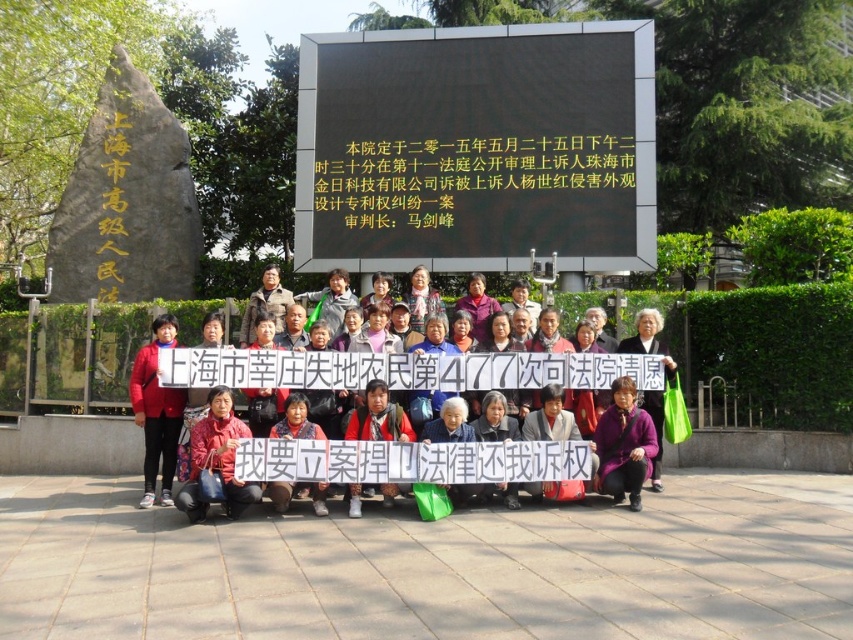
You are a journalist taking photos of the protest. You notice the black matte sign at upper center and the red matte jacket at center. Which object is located to the right of the other?

The black matte sign at upper center is positioned on the right side of red matte jacket at center, so the black matte sign at upper center is to the right of the red matte jacket at center.

You are a photographer standing at the edge of the protest area. You want to take a photo that includes both the red fabric sign at center and the purple matte jacket at lower center. The minimum distance between the two objects in the photo should be at least 12 feet to ensure they are clearly separated. Will this be possible?

The red fabric sign at center is 11.56 feet from the purple matte jacket at lower center. Since 11.56 feet is less than the required 12 feet, it will not be possible to have them clearly separated by at least 12 feet in the photo.

Where is the red fabric jacket at lower center located in the image?

The red fabric jacket at lower center is located at the 2D coordinates point (216, 461).